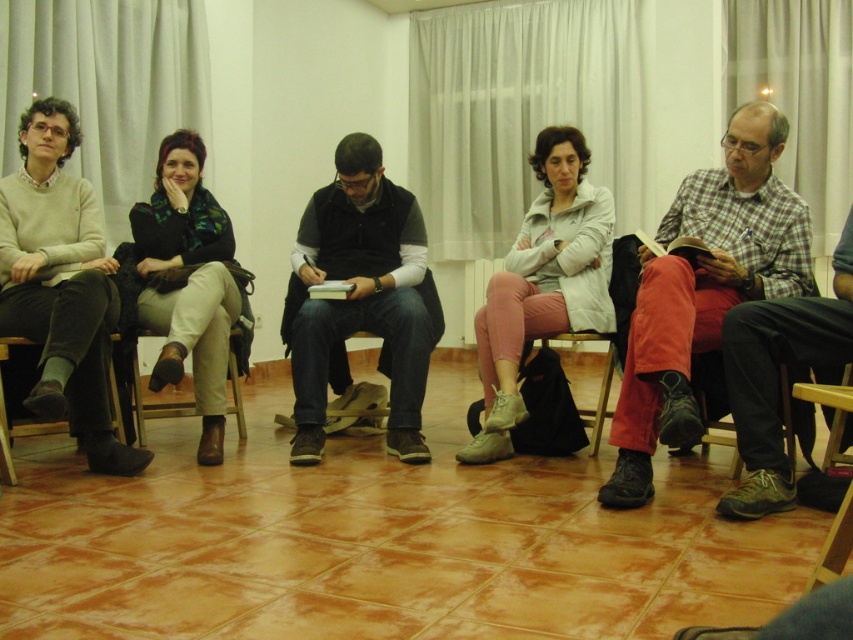
You are a photographer setting up a shoot in this room. You need to ensure that the light pink fabric pants at center and the wooden chair at lower right are both visible in the frame. Considering their heights, which one might require you to adjust your camera angle to capture fully?

The light pink fabric pants at center is taller than the wooden chair at lower right, so you might need to adjust the camera angle to capture the taller light pink fabric pants at center fully.

You are standing at the camera position and want to reach point point [677,298]. Is the distance more than 2 meters?

The distance between point point [677,298] and the camera is 2.51 meters, so yes, it is more than 2 meters.